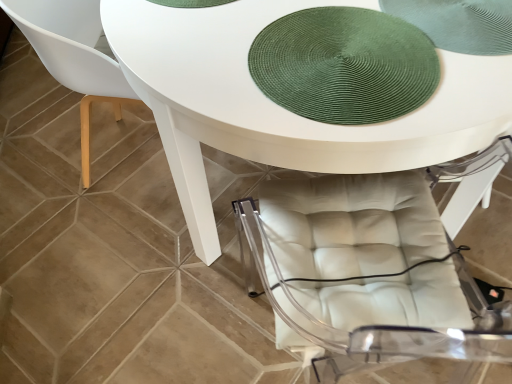
You are a GUI agent. You are given a task and a screenshot of the screen. Output one action in this format:
    pyautogui.click(x=<x>, y=<y>)
    Task: Click on the vacant space that is in between white glossy table at center and matte white chair at lower left
    
    Given the screenshot: What is the action you would take?
    pyautogui.click(x=127, y=260)